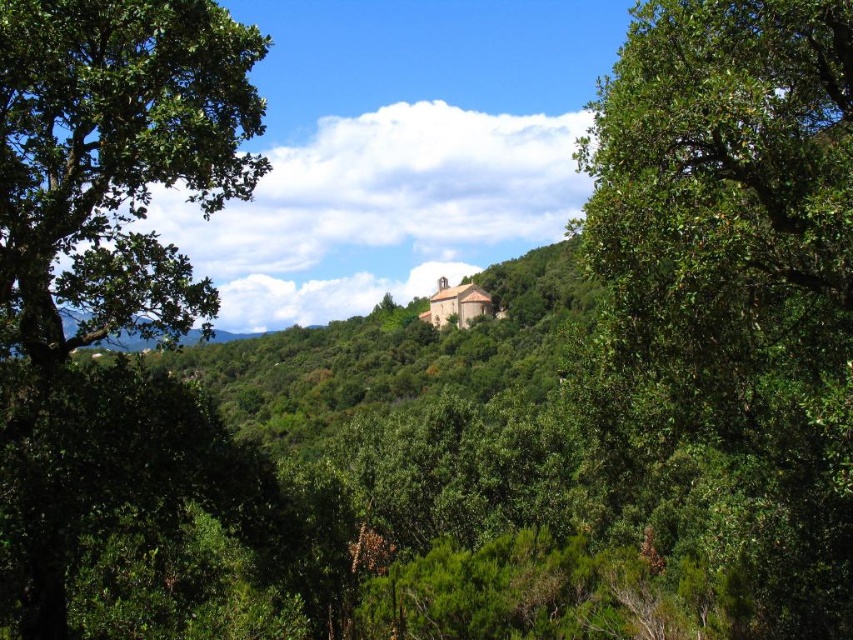
Question: Does green leafy tree at center appear on the left side of green leafy tree at left?

Choices:
 (A) no
 (B) yes

Answer: (A)

Question: Is green leafy tree at center bigger than green leafy tree at left?

Choices:
 (A) no
 (B) yes

Answer: (B)

Question: Does green leafy tree at center have a lesser width compared to green leafy tree at left?

Choices:
 (A) yes
 (B) no

Answer: (B)

Question: Which point appears closest to the camera in this image?

Choices:
 (A) [x=84, y=266]
 (B) [x=721, y=232]

Answer: (B)